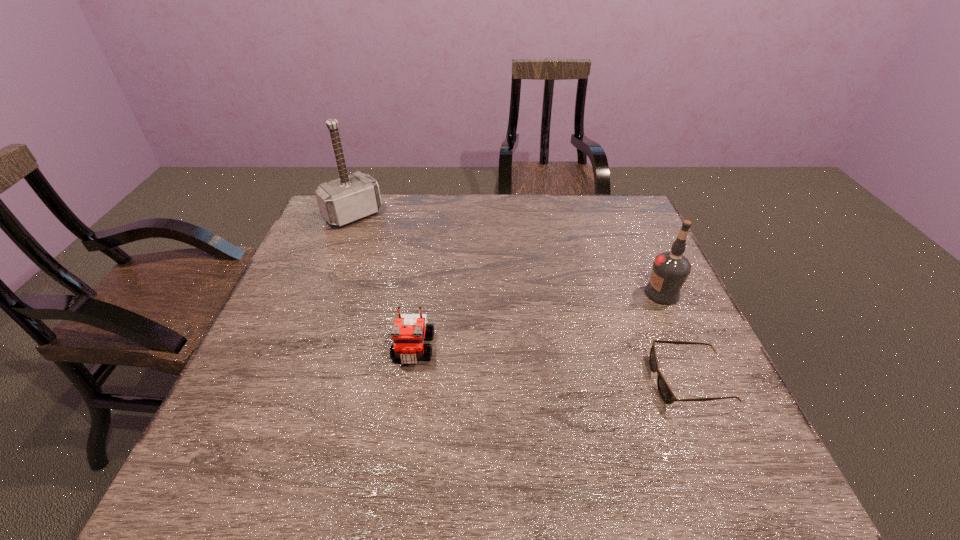
Select which object appears as the second closest to the Lego. Please provide its 2D coordinates. Your answer should be formatted as a tuple, i.e. [(x, y)], where the tuple contains the x and y coordinates of a point satisfying the conditions above.

[(665, 392)]

Find the location of `the third closest object to the second tallest object`. the third closest object to the second tallest object is located at coordinates (349, 198).

Locate an element on the screen. The width and height of the screenshot is (960, 540). vacant space that satisfies the following two spatial constraints: 1. on the front-facing side of the shortest object; 2. on the lenses of the third object from right to left is located at coordinates (409, 381).